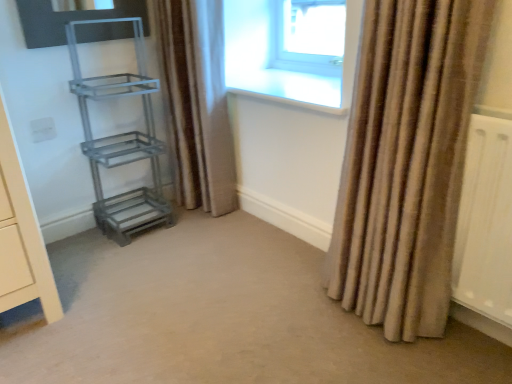
Where is `beige textured curtain at right, which appears as the 2th curtain when viewed from the left`? The image size is (512, 384). beige textured curtain at right, which appears as the 2th curtain when viewed from the left is located at coordinates (406, 162).

Measure the distance between metallic gray shelf at left, which is counted as the 2th shelf, starting from the bottom, and camera.

The depth of metallic gray shelf at left, which is counted as the 2th shelf, starting from the bottom, is 1.62 meters.

At what (x,y) coordinates should I click in order to perform the action: click on transparent glass window at upper center. Please return your answer as a coordinate pair (x, y). Image resolution: width=512 pixels, height=384 pixels. Looking at the image, I should click on (307, 36).

Locate an element on the screen. This screenshot has height=384, width=512. plain on the right side of metallic gray shelf at left, which ranks as the 1th shelf in top-to-bottom order is located at coordinates (219, 317).

Which of these two, metallic gray shelf at left, which ranks as the 1th shelf in top-to-bottom order, or carpet at center, is thinner?

With smaller width is metallic gray shelf at left, which ranks as the 1th shelf in top-to-bottom order.

Are metallic gray shelf at left, which is counted as the 2th shelf, starting from the bottom, and carpet at center beside each other?

No, metallic gray shelf at left, which is counted as the 2th shelf, starting from the bottom, is not touching carpet at center.

Can you confirm if carpet at center is wider than metallic gray shelf at left, which ranks as the 1th shelf in top-to-bottom order?

Correct, the width of carpet at center exceeds that of metallic gray shelf at left, which ranks as the 1th shelf in top-to-bottom order.

In the scene shown: Considering the relative sizes of carpet at center and metallic gray shelf at left, which ranks as the 1th shelf in top-to-bottom order, in the image provided, is carpet at center shorter than metallic gray shelf at left, which ranks as the 1th shelf in top-to-bottom order,?

Yes, carpet at center is shorter than metallic gray shelf at left, which ranks as the 1th shelf in top-to-bottom order.

Which is in front, carpet at center or metallic gray shelf at left, which ranks as the 1th shelf in top-to-bottom order?

carpet at center is closer to the camera.

Which is nearer, [306,296] or [121,137]?

The point [306,296] is in front.

From the image's perspective, between metallic gray shelf at lower left, the first shelf positioned from the bottom, and brown textured curtain at center, the 1th curtain viewed from the left, who is located below?

metallic gray shelf at lower left, the first shelf positioned from the bottom, appears lower in the image.

In the image, is metallic gray shelf at lower left, which ranks as the second shelf in top-to-bottom order, positioned in front of or behind brown textured curtain at center, the 2th curtain positioned from the front?

metallic gray shelf at lower left, which ranks as the second shelf in top-to-bottom order, is behind brown textured curtain at center, the 2th curtain positioned from the front.

The image size is (512, 384). Identify the location of the 2nd shelf counting from the left side of the brown textured curtain at center, the 1th curtain viewed from the left. (132, 213).

Which of these two, metallic gray shelf at lower left, which ranks as the second shelf in top-to-bottom order, or brown textured curtain at center, acting as the first curtain starting from the back, is smaller?

metallic gray shelf at lower left, which ranks as the second shelf in top-to-bottom order, is smaller.

Consider the image. Who is bigger, brown textured curtain at center, the 2th curtain when ordered from right to left, or carpet at center?

Bigger between the two is brown textured curtain at center, the 2th curtain when ordered from right to left.

From the image's perspective, which object appears higher, brown textured curtain at center, the 2th curtain positioned from the front, or carpet at center?

brown textured curtain at center, the 2th curtain positioned from the front, appears higher in the image.

Where is `curtain that appears on the left of carpet at center`? curtain that appears on the left of carpet at center is located at coordinates (196, 103).

Could you tell me if brown textured curtain at center, the 2th curtain when ordered from right to left, is turned towards carpet at center?

No, brown textured curtain at center, the 2th curtain when ordered from right to left, is not aimed at carpet at center.

Could you measure the distance between beige textured curtain at right, the 1th curtain viewed from the right, and brown textured curtain at center, the 2th curtain when ordered from right to left?

beige textured curtain at right, the 1th curtain viewed from the right, and brown textured curtain at center, the 2th curtain when ordered from right to left, are 35.55 inches apart from each other.

Which of these two, beige textured curtain at right, which appears as the second curtain when viewed from the back, or brown textured curtain at center, acting as the first curtain starting from the back, is bigger?

With larger size is beige textured curtain at right, which appears as the second curtain when viewed from the back.

Based on the photo, considering the sizes of beige textured curtain at right, which appears as the second curtain when viewed from the back, and brown textured curtain at center, the 1th curtain viewed from the left, in the image, is beige textured curtain at right, which appears as the second curtain when viewed from the back, taller or shorter than brown textured curtain at center, the 1th curtain viewed from the left,?

beige textured curtain at right, which appears as the second curtain when viewed from the back, is shorter than brown textured curtain at center, the 1th curtain viewed from the left.

From the picture: From the image's perspective, is beige textured curtain at right, the 1th curtain viewed from the right, below brown textured curtain at center, the 2th curtain positioned from the front?

Yes, from the image's perspective, beige textured curtain at right, the 1th curtain viewed from the right, is beneath brown textured curtain at center, the 2th curtain positioned from the front.

There is a metallic gray shelf at lower left, the first shelf positioned from the bottom. Identify the location of the 1st curtain above it (from a real-world perspective). The image size is (512, 384). point(406,162).

Does metallic gray shelf at lower left, which ranks as the second shelf in top-to-bottom order, have a larger size compared to beige textured curtain at right, which ranks as the first curtain in front-to-back order?

No.

Consider the image. Is there a large distance between metallic gray shelf at lower left, which ranks as the second shelf in top-to-bottom order, and beige textured curtain at right, which appears as the second curtain when viewed from the back?

That's right, there is a large distance between metallic gray shelf at lower left, which ranks as the second shelf in top-to-bottom order, and beige textured curtain at right, which appears as the second curtain when viewed from the back.

Is point (448, 339) farther from viewer compared to point (218, 135)?

No.

Find the location of a particular element. This screenshot has width=512, height=384. plain on the right of brown textured curtain at center, the 2th curtain positioned from the front is located at coordinates (219, 317).

Considering their positions, is carpet at center located in front of or behind brown textured curtain at center, the 2th curtain when ordered from right to left?

In the image, carpet at center appears in front of brown textured curtain at center, the 2th curtain when ordered from right to left.

Looking at this image, is carpet at center with brown textured curtain at center, the 2th curtain when ordered from right to left?

carpet at center and brown textured curtain at center, the 2th curtain when ordered from right to left, are not in contact.

Identify the location of plain below the metallic gray shelf at left, which is counted as the 2th shelf, starting from the bottom (from the image's perspective). The image size is (512, 384). (219, 317).

From a real-world perspective, count 2nd shelfs upward from the carpet at center and point to it. Please provide its 2D coordinates.

[(121, 142)]

Looking at the image, which one is located closer to transparent glass window at upper center, carpet at center or beige textured curtain at right, which appears as the 2th curtain when viewed from the left?

beige textured curtain at right, which appears as the 2th curtain when viewed from the left, is positioned closer to the anchor transparent glass window at upper center.

Which object lies further to the anchor point carpet at center, metallic gray shelf at left, which ranks as the 1th shelf in top-to-bottom order, or brown textured curtain at center, the 2th curtain when ordered from right to left?

brown textured curtain at center, the 2th curtain when ordered from right to left, is further to carpet at center.

Estimate the real-world distances between objects in this image. Which object is closer to metallic gray shelf at left, which is counted as the 2th shelf, starting from the bottom, carpet at center or beige textured curtain at right, which ranks as the first curtain in front-to-back order?

Among the two, carpet at center is located nearer to metallic gray shelf at left, which is counted as the 2th shelf, starting from the bottom.

Considering their positions, is beige textured curtain at right, which appears as the second curtain when viewed from the back, positioned further to brown textured curtain at center, the 2th curtain positioned from the front, than metallic gray shelf at lower left, which ranks as the second shelf in top-to-bottom order?

beige textured curtain at right, which appears as the second curtain when viewed from the back, lies further to brown textured curtain at center, the 2th curtain positioned from the front, than the other object.

From the image, which object appears to be nearer to transparent glass window at upper center, metallic gray shelf at left, which ranks as the 1th shelf in top-to-bottom order, or brown textured curtain at center, the 2th curtain positioned from the front?

brown textured curtain at center, the 2th curtain positioned from the front.

Based on their spatial positions, is beige textured curtain at right, which appears as the 2th curtain when viewed from the left, or metallic gray shelf at left, which is counted as the 2th shelf, starting from the bottom, further from metallic gray shelf at lower left, the first shelf positioned from the bottom?

beige textured curtain at right, which appears as the 2th curtain when viewed from the left, is further to metallic gray shelf at lower left, the first shelf positioned from the bottom.

Estimate the real-world distances between objects in this image. Which object is further from transparent glass window at upper center, carpet at center or brown textured curtain at center, acting as the first curtain starting from the back?

carpet at center is further to transparent glass window at upper center.

Considering their positions, is transparent glass window at upper center positioned closer to beige textured curtain at right, which appears as the second curtain when viewed from the back, than carpet at center?

The object closer to beige textured curtain at right, which appears as the second curtain when viewed from the back, is carpet at center.

Where is `shelf between brown textured curtain at center, the 2th curtain when ordered from right to left, and metallic gray shelf at lower left, the first shelf positioned from the bottom, vertically`? shelf between brown textured curtain at center, the 2th curtain when ordered from right to left, and metallic gray shelf at lower left, the first shelf positioned from the bottom, vertically is located at coordinates (121, 142).

At what (x,y) coordinates should I click in order to perform the action: click on curtain located between metallic gray shelf at left, which ranks as the 1th shelf in top-to-bottom order, and beige textured curtain at right, which appears as the second curtain when viewed from the back, in the left-right direction. Please return your answer as a coordinate pair (x, y). This screenshot has height=384, width=512. Looking at the image, I should click on (196, 103).

Where is `shelf positioned between carpet at center and metallic gray shelf at lower left, which ranks as the second shelf in top-to-bottom order, from near to far`? Image resolution: width=512 pixels, height=384 pixels. shelf positioned between carpet at center and metallic gray shelf at lower left, which ranks as the second shelf in top-to-bottom order, from near to far is located at coordinates (121, 142).

Locate an element on the screen. The image size is (512, 384). shelf between carpet at center and brown textured curtain at center, the 1th curtain viewed from the left, in the front-back direction is located at coordinates (121, 142).